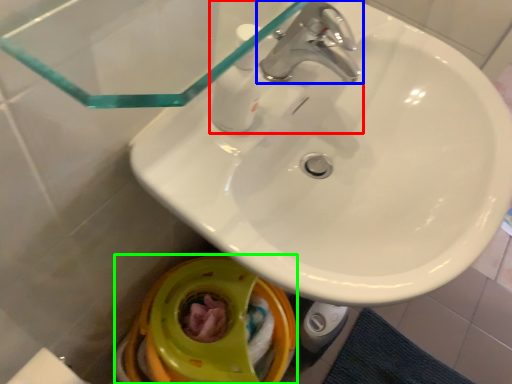
Question: Which object is positioned closest to tap (highlighted by a red box)? Select from tap (highlighted by a blue box) and toilet bowl (highlighted by a green box).

Choices:
 (A) tap
 (B) toilet bowl

Answer: (A)